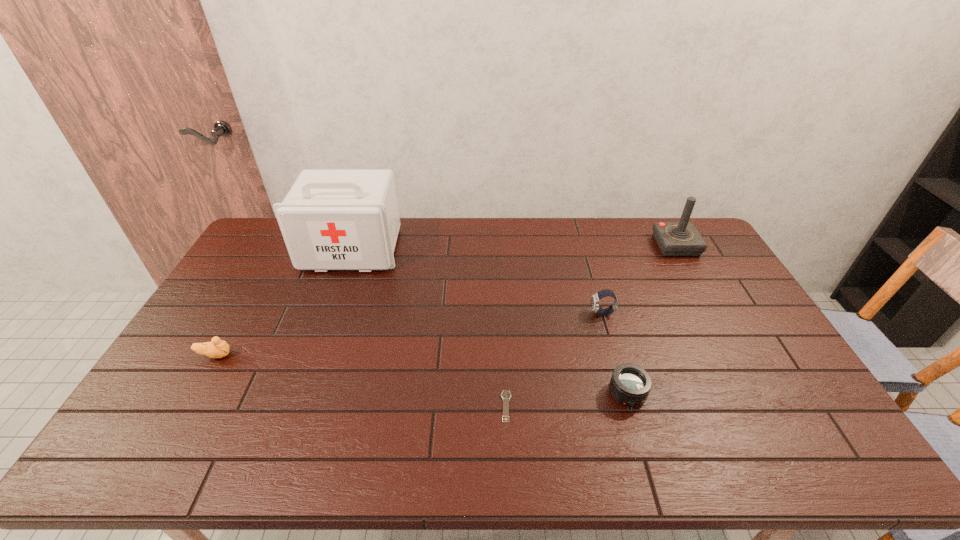
The image size is (960, 540). In order to click on the second object from left to right in this screenshot , I will do `click(330, 219)`.

Image resolution: width=960 pixels, height=540 pixels. Find the location of `the first-aid kit`. the first-aid kit is located at coordinates (330, 219).

Find the location of `the rightmost object`. the rightmost object is located at coordinates coord(681,238).

Where is `joystick`? Image resolution: width=960 pixels, height=540 pixels. joystick is located at coordinates (681, 238).

You are a GUI agent. You are given a task and a screenshot of the screen. Output one action in this format:
    pyautogui.click(x=<x>, y=<y>)
    Task: Click on the third farthest object
    The width and height of the screenshot is (960, 540).
    Given the screenshot: What is the action you would take?
    pyautogui.click(x=595, y=298)

Locate an element on the screen. the taller watch is located at coordinates (595, 298).

What are the coordinates of `the leftmost object` in the screenshot? It's located at pyautogui.click(x=218, y=348).

This screenshot has width=960, height=540. Identify the location of duckling. (218, 348).

Where is `telephoto lens`? telephoto lens is located at coordinates (x=630, y=384).

Locate an element on the screen. The image size is (960, 540). the shortest object is located at coordinates (506, 395).